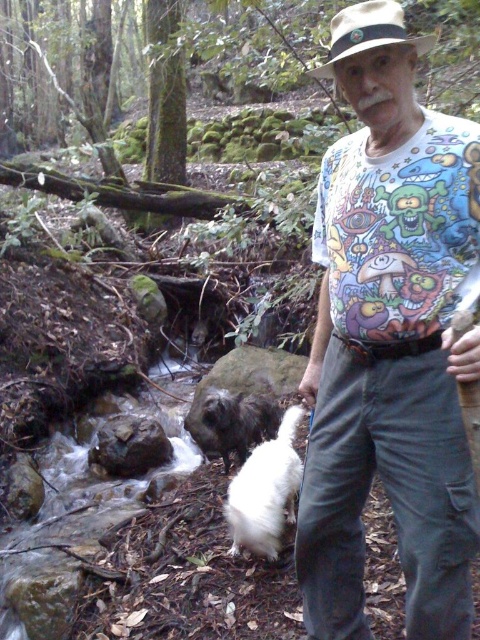
Question: Based on their relative distances, which object is nearer to the white fluffy dog at center?

Choices:
 (A) white printed t-shirt at center
 (B) shaggy black fur at center

Answer: (B)

Question: Is white printed t-shirt at center bigger than beige fabric fedora at upper center?

Choices:
 (A) yes
 (B) no

Answer: (A)

Question: Does white fluffy dog at center appear under shaggy black fur at center?

Choices:
 (A) yes
 (B) no

Answer: (A)

Question: Which object is farther from the camera taking this photo?

Choices:
 (A) beige fabric fedora at upper center
 (B) white fluffy dog at center

Answer: (B)

Question: Does white printed t-shirt at center lie behind shaggy black fur at center?

Choices:
 (A) yes
 (B) no

Answer: (B)

Question: Which point appears farthest from the camera in this image?

Choices:
 (A) click(278, 442)
 (B) click(402, 248)
 (C) click(264, 419)

Answer: (C)